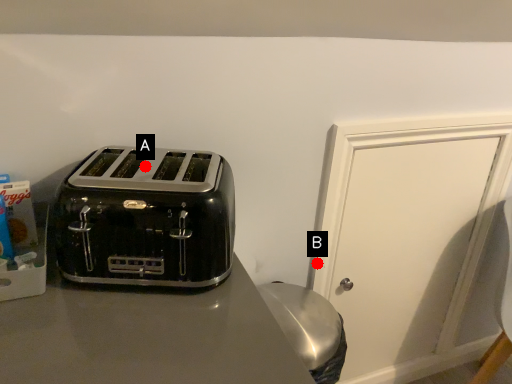
Question: Two points are circled on the image, labeled by A and B beside each circle. Which point is closer to the camera?

Choices:
 (A) A is closer
 (B) B is closer

Answer: (A)